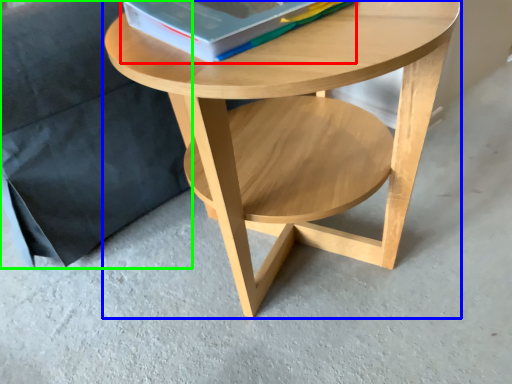
Question: Which is farther away from paperback book (highlighted by a red box)? coffee table (highlighted by a blue box) or armchair (highlighted by a green box)?

Choices:
 (A) coffee table
 (B) armchair

Answer: (B)